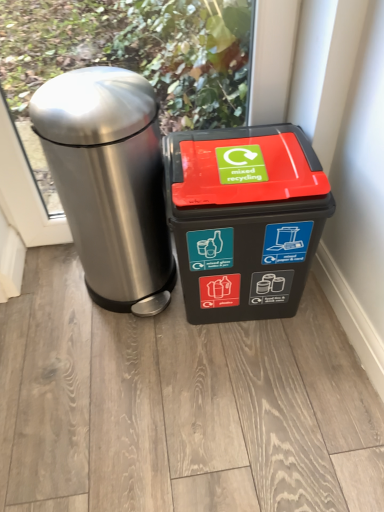
Question: From the image's perspective, is black plastic recycling bin at center, which is the 2th waste container from left to right, located above or below polished stainless steel trash can at left, arranged as the 1th waste container when viewed from the left?

Choices:
 (A) below
 (B) above

Answer: (A)

Question: In terms of width, does black plastic recycling bin at center, which is the 2th waste container from left to right, look wider or thinner when compared to polished stainless steel trash can at left, arranged as the 1th waste container when viewed from the left?

Choices:
 (A) wide
 (B) thin

Answer: (B)

Question: Is point (284, 212) closer or farther from the camera than point (135, 104)?

Choices:
 (A) closer
 (B) farther

Answer: (B)

Question: In the image, is polished stainless steel trash can at left, arranged as the second waste container when viewed from the right, on the left side or the right side of black plastic recycling bin at center, which is the 1th waste container from right to left?

Choices:
 (A) right
 (B) left

Answer: (B)

Question: Considering the positions of polished stainless steel trash can at left, arranged as the second waste container when viewed from the right, and black plastic recycling bin at center, which is the 2th waste container from left to right, in the image, is polished stainless steel trash can at left, arranged as the second waste container when viewed from the right, wider or thinner than black plastic recycling bin at center, which is the 2th waste container from left to right,?

Choices:
 (A) wide
 (B) thin

Answer: (A)

Question: From the image's perspective, relative to black plastic recycling bin at center, which is the 1th waste container from right to left, is polished stainless steel trash can at left, arranged as the second waste container when viewed from the right, above or below?

Choices:
 (A) above
 (B) below

Answer: (A)

Question: Considering the positions of polished stainless steel trash can at left, arranged as the 1th waste container when viewed from the left, and black plastic recycling bin at center, which is the 2th waste container from left to right, in the image, is polished stainless steel trash can at left, arranged as the 1th waste container when viewed from the left, bigger or smaller than black plastic recycling bin at center, which is the 2th waste container from left to right,?

Choices:
 (A) small
 (B) big

Answer: (B)